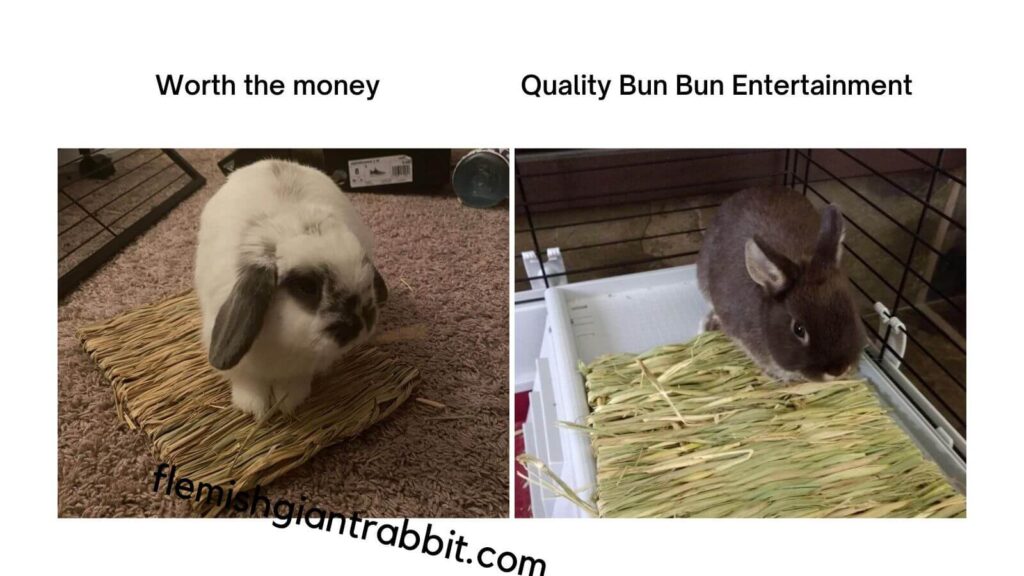
Where is `concrete floor`? concrete floor is located at coordinates (670, 226).